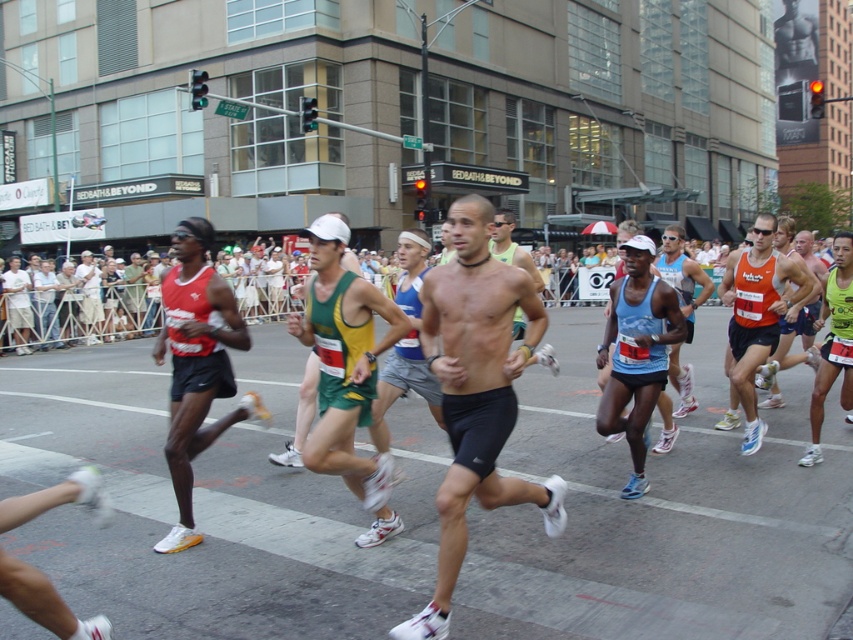
This screenshot has width=853, height=640. Identify the location of matte red tank top at left. (196, 364).

Is matte red tank top at left positioned at the back of orange mesh tank top at center?

No, it is not.

What do you see at coordinates (196, 364) in the screenshot?
I see `matte red tank top at left` at bounding box center [196, 364].

This screenshot has height=640, width=853. I want to click on matte red tank top at left, so coord(196,364).

Who is lower down, shiny black shorts at center or orange mesh tank top at center?

shiny black shorts at center

Can you confirm if shiny black shorts at center is smaller than orange mesh tank top at center?

Yes, shiny black shorts at center is smaller than orange mesh tank top at center.

The image size is (853, 640). What do you see at coordinates (476, 394) in the screenshot?
I see `shiny black shorts at center` at bounding box center [476, 394].

At what (x,y) coordinates should I click in order to perform the action: click on shiny black shorts at center. Please return your answer as a coordinate pair (x, y). This screenshot has width=853, height=640. Looking at the image, I should click on (476, 394).

Does orange mesh tank top at center have a greater width compared to reddish-brown tank top at left?

Yes.

Which is more to the right, orange mesh tank top at center or reddish-brown tank top at left?

orange mesh tank top at center is more to the right.

What do you see at coordinates (756, 314) in the screenshot? I see `orange mesh tank top at center` at bounding box center [756, 314].

Where is `orange mesh tank top at center`? This screenshot has width=853, height=640. orange mesh tank top at center is located at coordinates (756, 314).